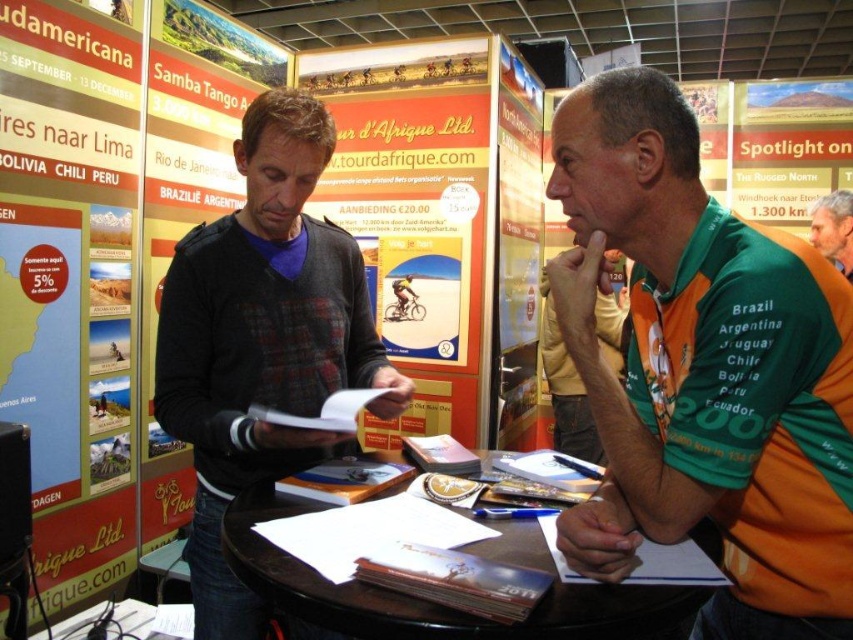
You are a photographer at the travel fair. You need to take a photo of the dark gray sweater at center and the green jersey at right. Based on their positions, which one should you focus on first to ensure both are in the frame?

The dark gray sweater at center is positioned on the left side of green jersey at right, so you should focus on the dark gray sweater at center first to ensure both are in the frame.

You are organizing a travel fair and need to arrange name tags for two attendees. One is wearing the dark gray sweater at center and the other the green jersey at upper right. If you want to place both name tags so they are visible from the front, where should each be placed?

The dark gray sweater at center is located below the green jersey at upper right. Therefore, the name tag for the dark gray sweater at center should be placed lower on their torso, while the green jersey at upper right name tag should be placed higher up on their clothing to ensure visibility from the front.